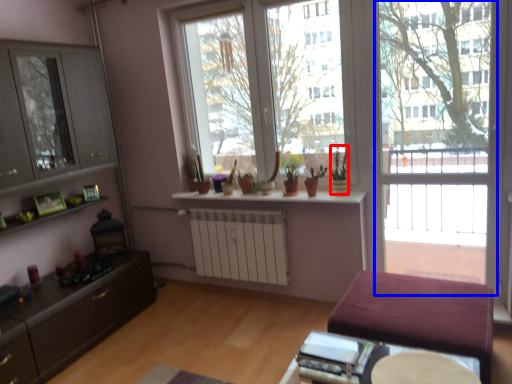
Question: Which object is further to the camera taking this photo, houseplant (highlighted by a red box) or screen door (highlighted by a blue box)?

Choices:
 (A) houseplant
 (B) screen door

Answer: (A)